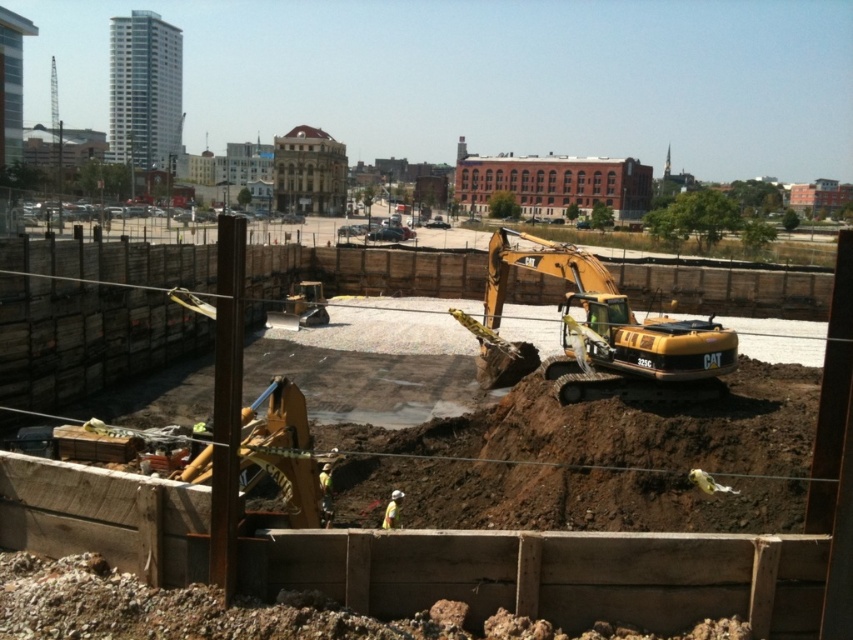
Question: Does brown/dry soil at lower center appear on the left side of yellow metallic excavator at center?

Choices:
 (A) yes
 (B) no

Answer: (A)

Question: Observing the image, what is the correct spatial positioning of yellow excavator at center in reference to yellow metallic excavator at center?

Choices:
 (A) left
 (B) right

Answer: (A)

Question: Which object is positioned farthest from the yellow metallic excavator at center?

Choices:
 (A) brown/dry soil at lower center
 (B) yellow excavator at center

Answer: (A)

Question: Which of the following is the farthest from the observer?

Choices:
 (A) yellow excavator at center
 (B) brown/dry soil at lower center
 (C) yellow metallic excavator at center

Answer: (C)

Question: Estimate the real-world distances between objects in this image. Which object is farther from the yellow metallic excavator at center?

Choices:
 (A) yellow excavator at center
 (B) brown/dry soil at lower center

Answer: (B)

Question: Can you confirm if yellow excavator at center is smaller than yellow metallic excavator at center?

Choices:
 (A) yes
 (B) no

Answer: (A)